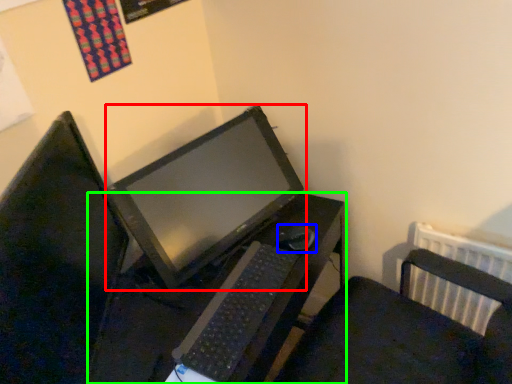
Question: Which object is the farthest from table (highlighted by a red box)? Choose among these: mouse (highlighted by a blue box) or desk (highlighted by a green box).

Choices:
 (A) mouse
 (B) desk

Answer: (A)